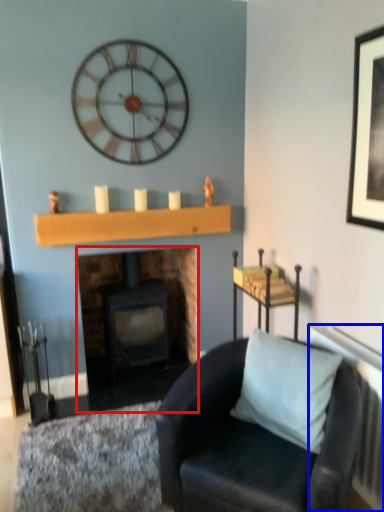
Question: Which point is further to the camera, fireplace (highlighted by a red box) or radiator (highlighted by a blue box)?

Choices:
 (A) fireplace
 (B) radiator

Answer: (A)